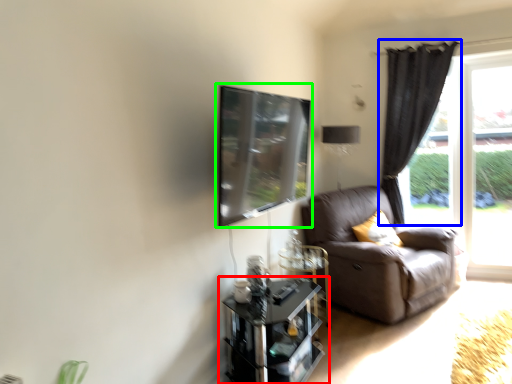
Question: Estimate the real-world distances between objects in this image. Which object is farther from table (highlighted by a red box), curtain (highlighted by a blue box) or window screen (highlighted by a green box)?

Choices:
 (A) curtain
 (B) window screen

Answer: (A)